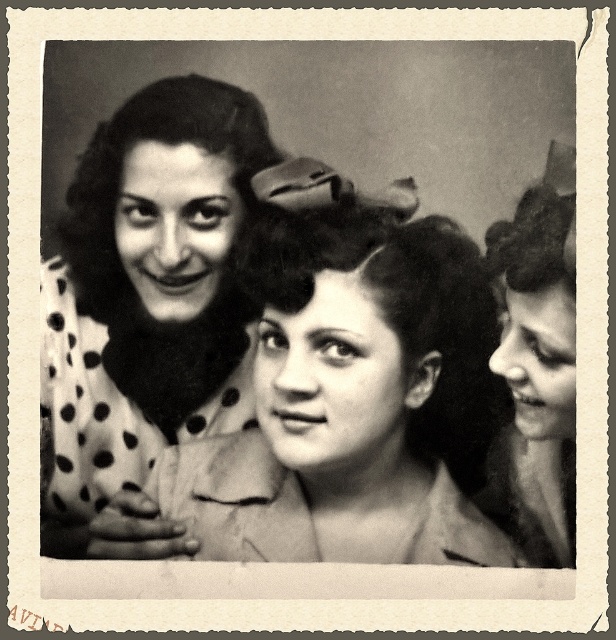
Question: Which of the following is the closest to the observer?

Choices:
 (A) polka dot fabric at center
 (B) curly dark hair at center

Answer: (B)

Question: Is curly dark hair at center to the right of smooth skin face at right from the viewer's perspective?

Choices:
 (A) no
 (B) yes

Answer: (A)

Question: Is polka dot fabric at center to the left of smooth skin face at right from the viewer's perspective?

Choices:
 (A) no
 (B) yes

Answer: (B)

Question: Which point is closer to the camera?

Choices:
 (A) (213, 380)
 (B) (450, 291)

Answer: (B)

Question: Among these objects, which one is farthest from the camera?

Choices:
 (A) curly dark hair at center
 (B) polka dot fabric at center
 (C) smooth skin face at right

Answer: (B)

Question: Does curly dark hair at center have a lesser width compared to smooth skin face at right?

Choices:
 (A) yes
 (B) no

Answer: (B)